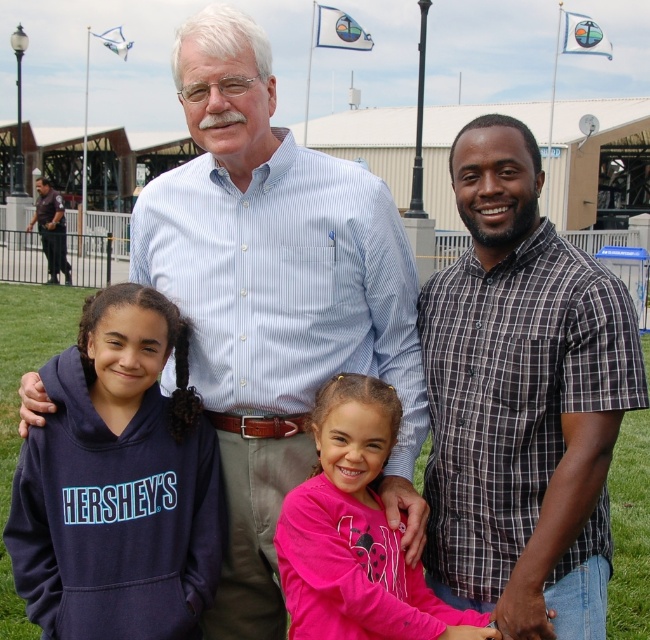
Question: Which point is closer to the camera?

Choices:
 (A) (352, 289)
 (B) (31, 504)

Answer: (B)

Question: Which object appears closest to the camera in this image?

Choices:
 (A) dark blue uniform at left
 (B) plaid shirt at right

Answer: (B)

Question: Does plaid shirt at right have a smaller size compared to navy blue hoodie at left?

Choices:
 (A) no
 (B) yes

Answer: (A)

Question: Is light blue striped shirt at center to the left of navy blue hoodie at left from the viewer's perspective?

Choices:
 (A) no
 (B) yes

Answer: (A)

Question: Which of the following is the closest to the observer?

Choices:
 (A) pink matte shirt at center
 (B) plaid shirt at right

Answer: (B)

Question: Is plaid shirt at right closer to camera compared to navy blue hoodie at left?

Choices:
 (A) no
 (B) yes

Answer: (B)